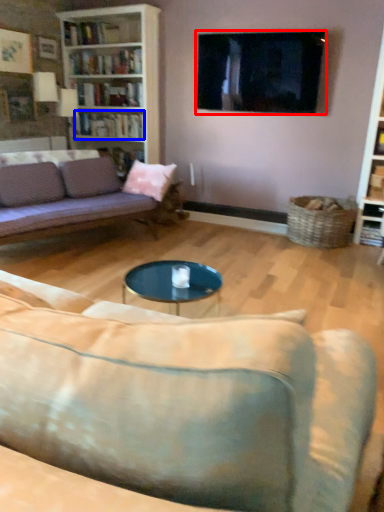
Question: Which of the following is the closest to the observer, television (highlighted by a red box) or book (highlighted by a blue box)?

Choices:
 (A) television
 (B) book

Answer: (A)